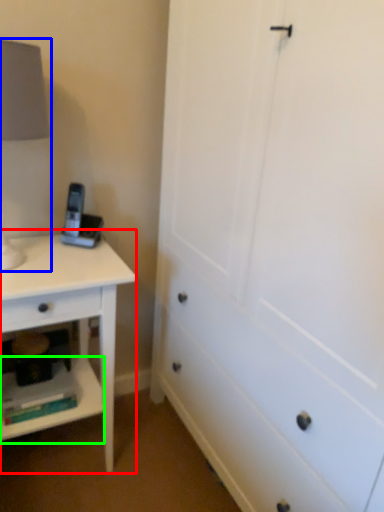
Question: Which is nearer to the nightstand (highlighted by a red box)? table lamp (highlighted by a blue box) or shelf (highlighted by a green box).

Choices:
 (A) table lamp
 (B) shelf

Answer: (B)